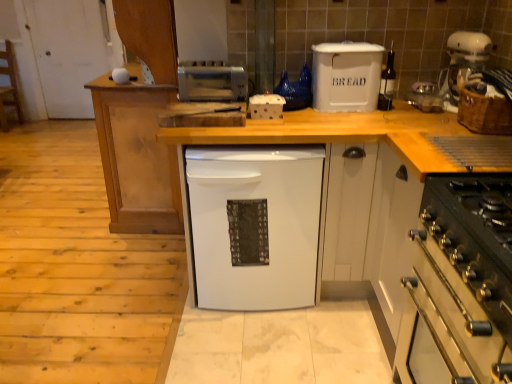
The width and height of the screenshot is (512, 384). Find the location of `free space on the front side of white matte dishwasher at center`. free space on the front side of white matte dishwasher at center is located at coordinates (251, 350).